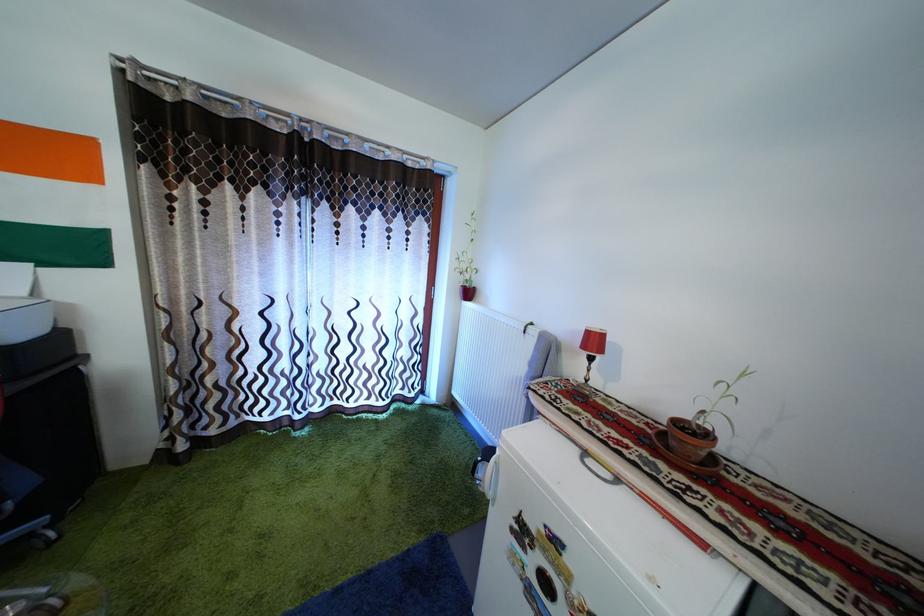
This screenshot has width=924, height=616. Describe the element at coordinates (490, 479) in the screenshot. I see `the gray refrigerator handle` at that location.